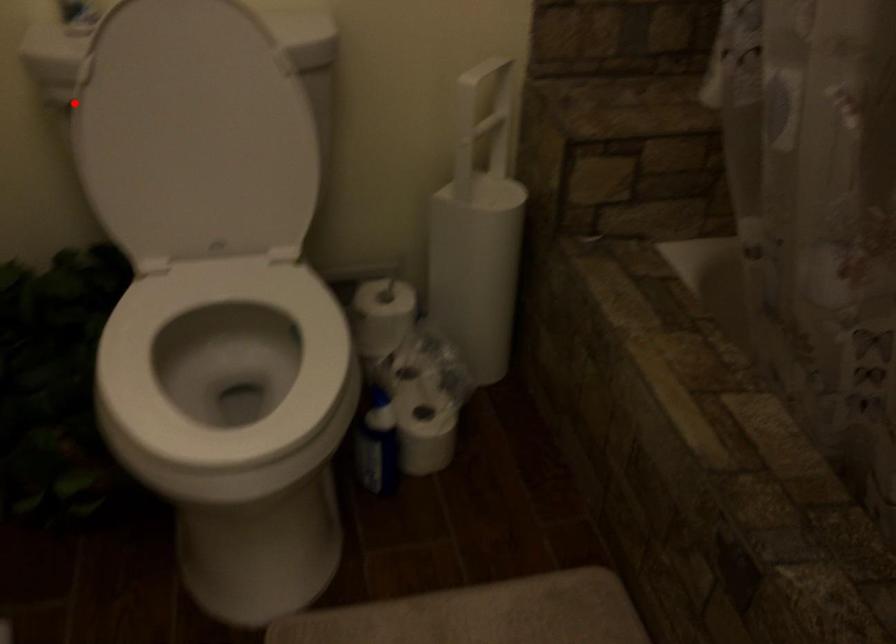
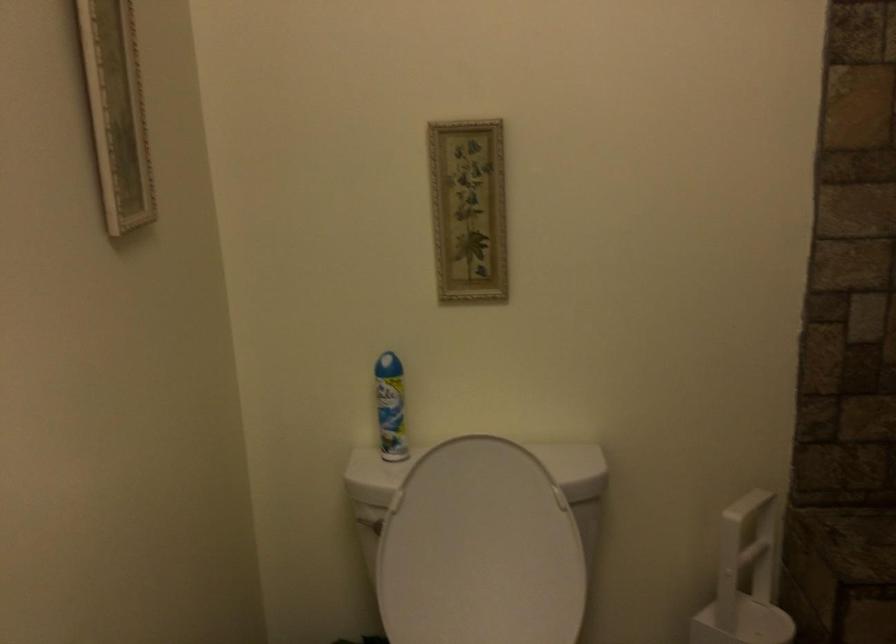
Find the pixel in the second image that matches the highlighted location in the first image.

(368, 522)